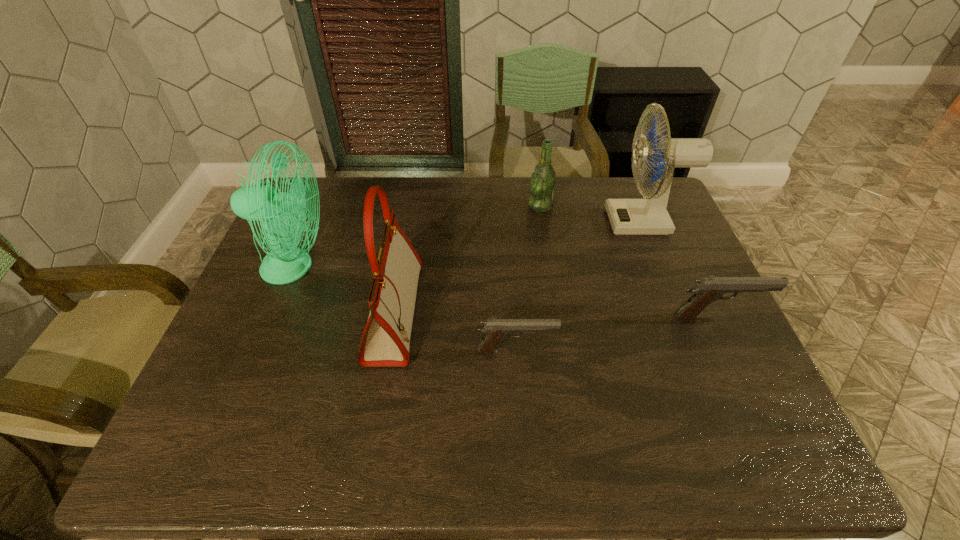
Find the location of a particular element. The height and width of the screenshot is (540, 960). vacant region located 0.160m on the surface of the beer bottle is located at coordinates (479, 206).

The image size is (960, 540). I want to click on vacant space situated 0.380m on the surface of the beer bottle, so click(412, 206).

Where is `vacant point located on the front-facing side of the right fan`? vacant point located on the front-facing side of the right fan is located at coordinates (503, 221).

Find the location of a particular element. This screenshot has width=960, height=540. blank space located on the front-facing side of the right fan is located at coordinates (551, 221).

What are the coordinates of `vacant space located on the front-facing side of the right fan` in the screenshot? It's located at (532, 221).

I want to click on free location located 0.090m on the right of the handbag, so click(452, 313).

Identify the location of free spot located 0.290m in front of the leftmost object to blow air. point(429,267).

You are a GUI agent. You are given a task and a screenshot of the screen. Output one action in this format:
    pyautogui.click(x=<x>, y=<y>)
    Task: Click on the beer bottle located at the far edge
    
    Given the screenshot: What is the action you would take?
    pyautogui.click(x=543, y=180)

What are the coordinates of `fan that is at the far edge` in the screenshot? It's located at (649, 216).

At what (x,y) coordinates should I click in order to perform the action: click on object that is at the left edge. Please return your answer as a coordinate pair (x, y). Looking at the image, I should click on (282, 214).